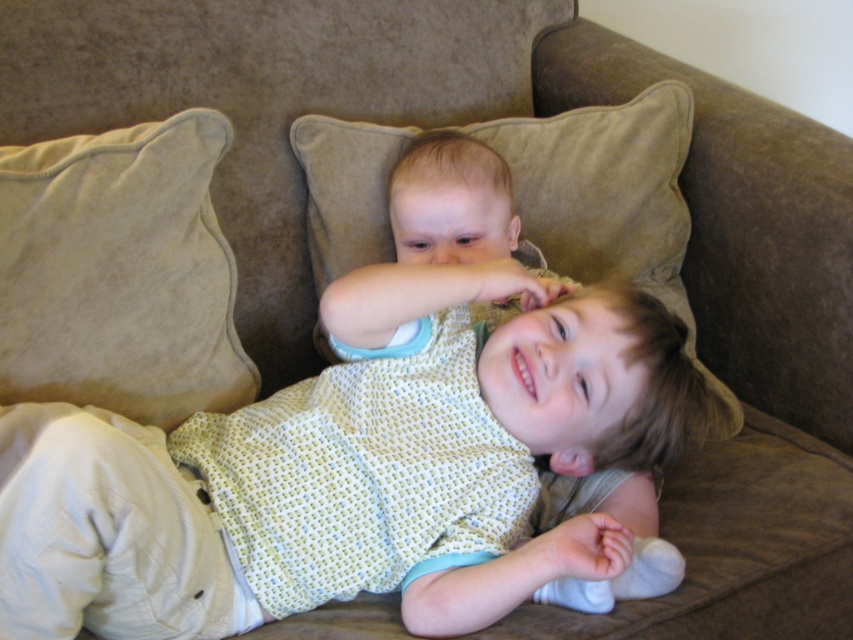
Question: Which of these objects is positioned closest to the beige suede pillow at left?

Choices:
 (A) light yellow knitted sweater at center
 (B) beige suede pillow at center

Answer: (A)

Question: Does beige suede pillow at left appear on the left side of beige suede pillow at center?

Choices:
 (A) yes
 (B) no

Answer: (A)

Question: Can you confirm if light yellow knitted sweater at center is smaller than beige suede pillow at left?

Choices:
 (A) yes
 (B) no

Answer: (B)

Question: Which object appears closest to the camera in this image?

Choices:
 (A) light yellow knitted sweater at center
 (B) beige suede pillow at center
 (C) beige suede pillow at left

Answer: (A)

Question: Is beige suede pillow at left thinner than beige suede pillow at center?

Choices:
 (A) no
 (B) yes

Answer: (B)

Question: Which point appears closest to the camera in this image?

Choices:
 (A) (169, 301)
 (B) (329, 147)
 (C) (169, 576)

Answer: (C)